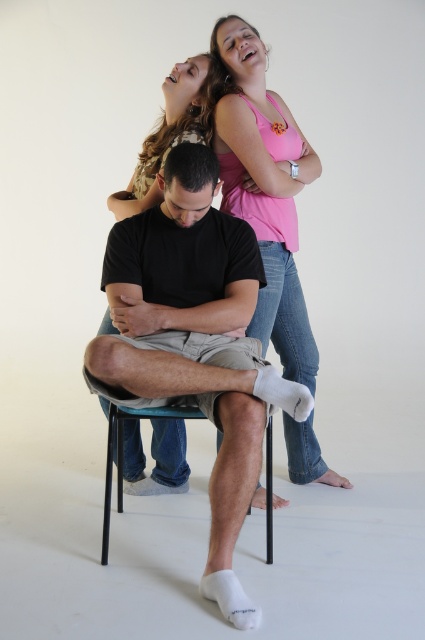
This screenshot has height=640, width=425. I want to click on black cotton shirt at center, so click(206, 339).

Which is above, black cotton shirt at center or pink cotton tank top at upper center?

pink cotton tank top at upper center is above.

Who is more distant from viewer, (232, 518) or (240, 161)?

Positioned behind is point (240, 161).

Locate an element on the screen. black cotton shirt at center is located at coordinates (206, 339).

Is point (220, 288) in front of point (158, 422)?

Yes, point (220, 288) is closer to viewer.

Does black cotton shirt at center appear on the right side of pink fabric shirt at upper center?

Indeed, black cotton shirt at center is positioned on the right side of pink fabric shirt at upper center.

In order to click on black cotton shirt at center in this screenshot , I will do click(206, 339).

Between black matte arm at center and black plastic chair at lower center, which one appears on the left side from the viewer's perspective?

Positioned to the left is black plastic chair at lower center.

Between black matte arm at center and black plastic chair at lower center, which one has less height?

With less height is black matte arm at center.

This screenshot has height=640, width=425. What do you see at coordinates (181, 269) in the screenshot?
I see `black matte arm at center` at bounding box center [181, 269].

What are the coordinates of `black matte arm at center` in the screenshot? It's located at (181, 269).